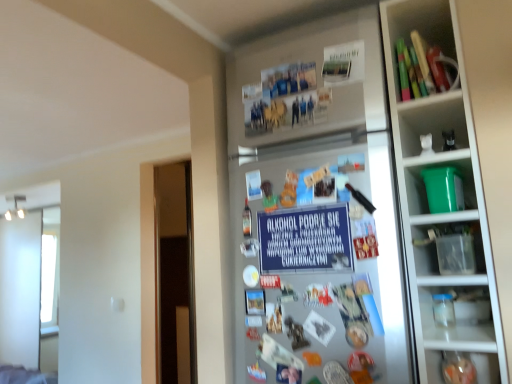
Question: Is blue paper sign at center oriented away from green plastic bucket at right, which is counted as the 2th shelf, starting from the top?

Choices:
 (A) yes
 (B) no

Answer: (B)

Question: Can you confirm if blue paper sign at center is smaller than green plastic bucket at right, positioned as the 1th shelf in bottom-to-top order?

Choices:
 (A) no
 (B) yes

Answer: (B)

Question: Does blue paper sign at center have a lesser height compared to green plastic bucket at right, which is counted as the 2th shelf, starting from the top?

Choices:
 (A) yes
 (B) no

Answer: (B)

Question: From a real-world perspective, is blue paper sign at center physically below green plastic bucket at right, which is counted as the 2th shelf, starting from the top?

Choices:
 (A) yes
 (B) no

Answer: (A)

Question: Is blue paper sign at center to the right of green plastic bucket at right, which is counted as the 2th shelf, starting from the top, from the viewer's perspective?

Choices:
 (A) yes
 (B) no

Answer: (B)

Question: Is point (286, 213) closer or farther from the camera than point (312, 162)?

Choices:
 (A) farther
 (B) closer

Answer: (A)

Question: Would you say blue paper sign at center is inside or outside silver metallic fridge at center?

Choices:
 (A) inside
 (B) outside

Answer: (A)

Question: Is blue paper sign at center wider or thinner than silver metallic fridge at center?

Choices:
 (A) wide
 (B) thin

Answer: (B)

Question: Would you say blue paper sign at center is to the left or to the right of silver metallic fridge at center in the picture?

Choices:
 (A) right
 (B) left

Answer: (B)

Question: Considering the positions of wooden blocks at upper right, which is counted as the second shelf, starting from the bottom, and green plastic bucket at right, positioned as the 1th shelf in bottom-to-top order, in the image, is wooden blocks at upper right, which is counted as the second shelf, starting from the bottom, wider or thinner than green plastic bucket at right, positioned as the 1th shelf in bottom-to-top order,?

Choices:
 (A) thin
 (B) wide

Answer: (A)

Question: From the image's perspective, is wooden blocks at upper right, which is counted as the second shelf, starting from the bottom, positioned above or below green plastic bucket at right, positioned as the 1th shelf in bottom-to-top order?

Choices:
 (A) below
 (B) above

Answer: (B)

Question: Is wooden blocks at upper right, positioned as the first shelf in top-to-bottom order, taller or shorter than green plastic bucket at right, positioned as the 1th shelf in bottom-to-top order?

Choices:
 (A) tall
 (B) short

Answer: (A)

Question: Choose the correct answer: Is wooden blocks at upper right, positioned as the first shelf in top-to-bottom order, inside green plastic bucket at right, positioned as the 1th shelf in bottom-to-top order, or outside it?

Choices:
 (A) outside
 (B) inside

Answer: (A)

Question: From a real-world perspective, is silver metallic fridge at center physically located above or below wooden blocks at upper right, positioned as the first shelf in top-to-bottom order?

Choices:
 (A) above
 (B) below

Answer: (B)

Question: Considering the positions of point (335, 125) and point (439, 26), is point (335, 125) closer or farther from the camera than point (439, 26)?

Choices:
 (A) farther
 (B) closer

Answer: (B)